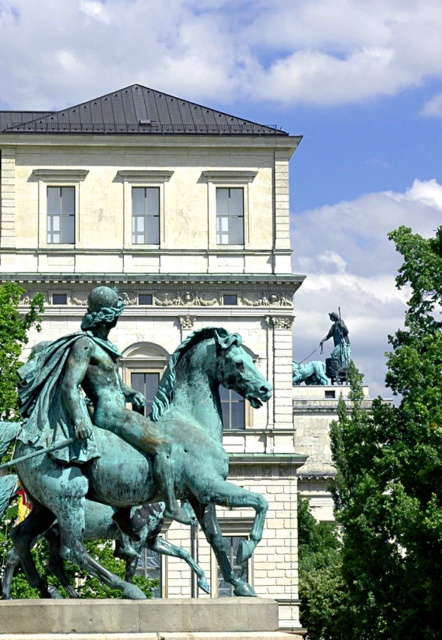
You are standing in front of the grand building and notice two points marked in the image. The first point is at coordinates point (x=204, y=342) and the second is at point (x=327, y=333). Which of these two points is closer to you?

Point (x=204, y=342) is closer to the camera than point (x=327, y=333).

What object is located at the coordinates point (209,433) in the image?

The green patina horse at center is located at point (209,433).

You are an architect analyzing the spatial arrangement of the scene. Based on the image, which object is located higher in the visual hierarchy, the matte bronze palace at center or the bronze statue at center?

The matte bronze palace at center is positioned over the bronze statue at center, making it higher in the visual hierarchy.